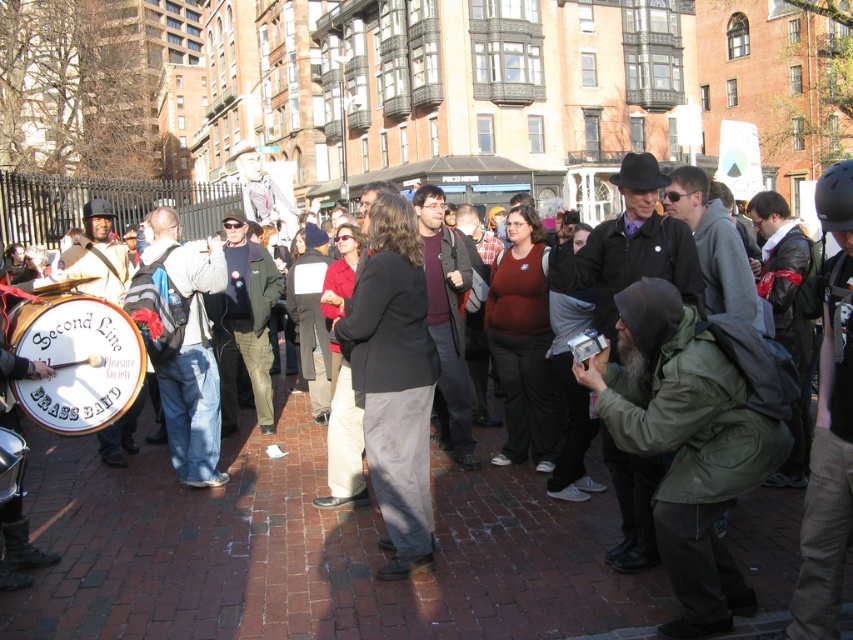
Is dark gray suit at center shorter than matte black drum at lower left?

Incorrect, dark gray suit at center's height does not fall short of matte black drum at lower left's.

The image size is (853, 640). In order to click on dark gray suit at center in this screenshot , I will do `click(393, 380)`.

The width and height of the screenshot is (853, 640). Identify the location of dark gray suit at center. (393, 380).

Who is lower down, dark gray suit at center or white leather drum at left?

dark gray suit at center is lower down.

Can you confirm if dark gray suit at center is taller than white leather drum at left?

Yes.

Between point (357, 358) and point (132, 378), which one is positioned in front?

Point (132, 378)

Identify the location of dark gray suit at center. This screenshot has height=640, width=853. (393, 380).

Can you confirm if white leather drum at left is shorter than matte black drum at lower left?

No, white leather drum at left is not shorter than matte black drum at lower left.

Describe the element at coordinates (76, 362) in the screenshot. I see `white leather drum at left` at that location.

The width and height of the screenshot is (853, 640). Identify the location of white leather drum at left. (76, 362).